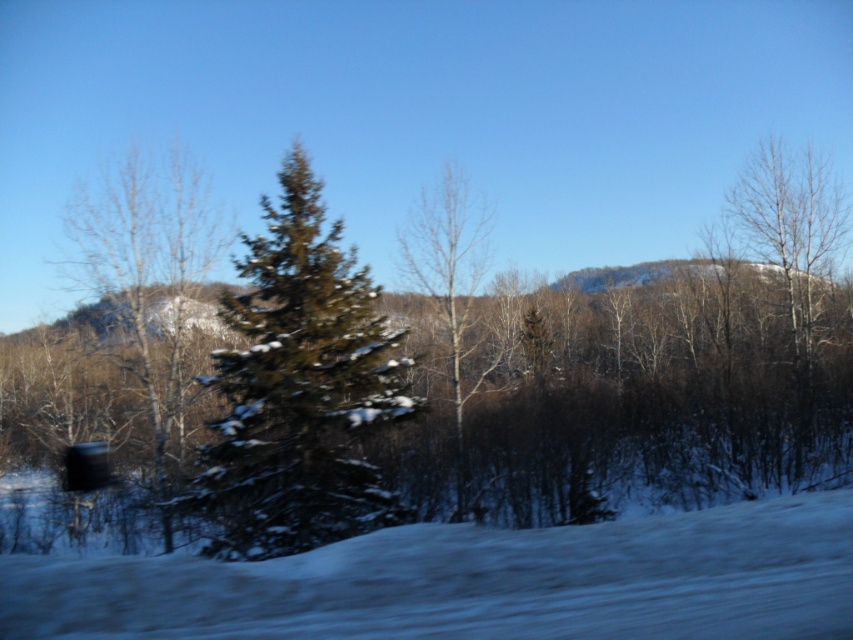
You are an observer standing in the winter landscape. You see two trees in front of you. The first is a bare wood tree at right, and the second is a bare wood tree at center. Which tree is positioned to the right of the other?

The bare wood tree at right is positioned to the right of the bare wood tree at center.

You are standing at the point marked by point [474,582] in the lower center of the image. Looking around, you see a snow covered ground and a prominent evergreen tree. Which direction should you walk to reach the evergreen tree?

Since the point [474,582] is at the lower center and the evergreen tree is in the foreground, you should walk forward to reach the evergreen tree.

You are standing at the point labeled as point (299, 388) in the winter landscape image. Which object from the scene are you standing on?

You are standing on the green textured pine tree at center.